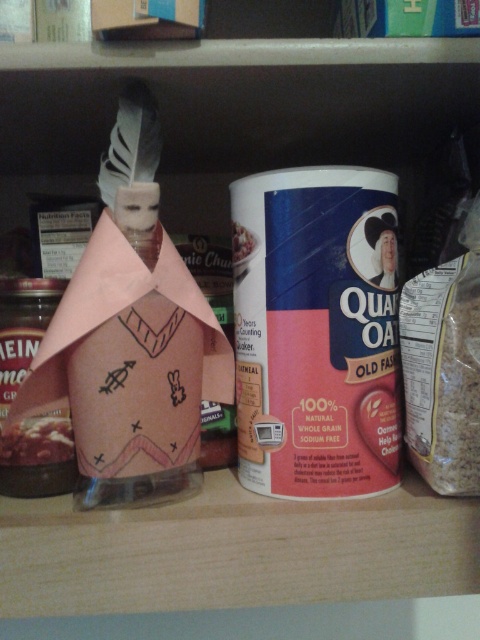
You are organizing a pantry and need to place a 1.5 inch wide can between the matte plastic bottle at center and the brown matte jar at center. Can you fit it there?

The matte plastic bottle at center and brown matte jar at center are 1.41 inches apart. Since the can is 1.5 inches wide, it cannot fit between them as the space is slightly narrower than the can.

You are standing 1 meter away from a shelf. You see a brown matte jar at center. Can you reach it without moving closer?

The brown matte jar at center is 56.15 centimeters away from the viewer. Since you are standing 1 meter away, which is 100 centimeters, you are farther away than the jar. Therefore, you cannot reach it without moving closer.

You have a storage container that can only fit items wider than 10 cm. Based on the scene, can the matte plastic bottle at center and the smooth white rice at center both fit in the container?

The matte plastic bottle at center is wider than the smooth white rice at center. Since the container requires items wider than 10 cm, we need to know the exact width of the matte plastic bottle at center. However, the description only states that it is wider than the rice, but not by how much. Therefore, it is uncertain if the bottle meets the 10 cm requirement.